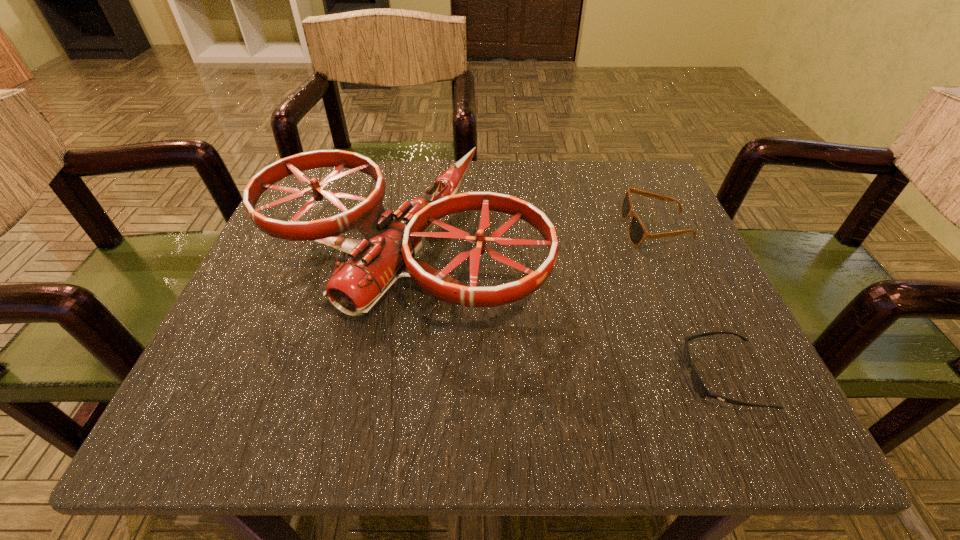
Where is `drone`? The width and height of the screenshot is (960, 540). drone is located at coordinates (356, 286).

Locate an element on the screen. Image resolution: width=960 pixels, height=540 pixels. the leftmost object is located at coordinates (356, 286).

Where is `the taller sunglasses`? This screenshot has height=540, width=960. the taller sunglasses is located at coordinates (637, 232).

I want to click on the second shortest object, so click(637, 232).

What are the coordinates of `the shortest object` in the screenshot? It's located at (700, 388).

Find the location of a particular element. The height and width of the screenshot is (540, 960). the nearer sunglasses is located at coordinates (700, 388).

At what (x,y) coordinates should I click in order to perform the action: click on vacant space positioned 0.100m on the right of the tallest object. Please return your answer as a coordinate pair (x, y). Looking at the image, I should click on (599, 248).

Identify the location of vacant region located 0.230m on the frames of the second tallest object. This screenshot has height=540, width=960. (503, 228).

The height and width of the screenshot is (540, 960). Find the location of `free space located 0.160m on the frames of the second tallest object`. free space located 0.160m on the frames of the second tallest object is located at coordinates (540, 228).

Identify the location of vacant position located on the frames of the second tallest object. (455, 228).